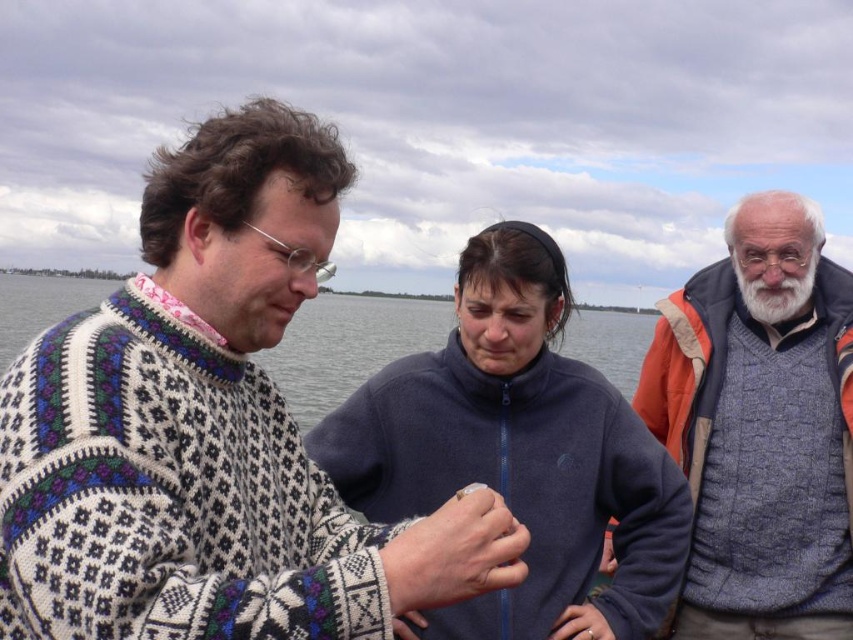
Based on the scene description, can you determine the spatial relationship between the gray wool sweater at right and the white fluffy beard at upper right?

The gray wool sweater at right is located to the left of the white fluffy beard at upper right.

You are standing in the scene and want to hand a small item to the person wearing the dark blue fleece at center. Which direction should you move to ensure the knitted sweater at center doesn not block your view?

You should move to the side of the knitted sweater at center so that the dark blue fleece at center becomes visible. Since the knitted sweater at center is in front of the dark blue fleece at center, moving to the side of the knitted sweater at center will allow you to see around it and reach the dark blue fleece at center without obstruction.

You are a fashion designer observing the three people in the image. You need to decide which of the two items, the gray wool sweater at right or the white fluffy beard at upper right, requires a larger fabric or material quantity for its creation. Based on the image, which one would you choose?

The gray wool sweater at right is bigger than the white fluffy beard at upper right, so the gray wool sweater at right would require more fabric or material for its creation.